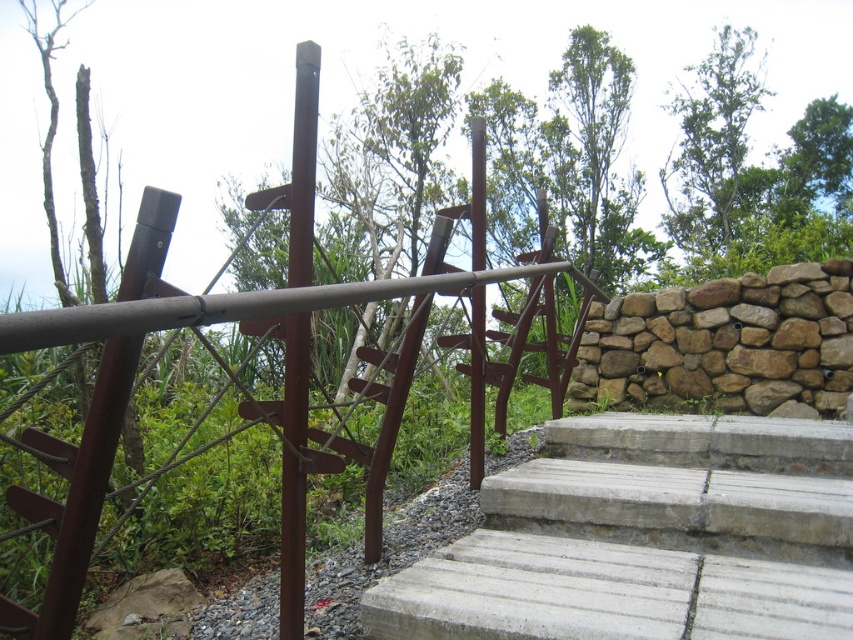
Is point (718, 358) less distant than point (473, 342)?

No.

Is point (595, 307) closer to camera compared to point (480, 356)?

No, it is behind (480, 356).

Locate an element on the screen. Image resolution: width=853 pixels, height=640 pixels. brown rough stone wall at right is located at coordinates (724, 344).

Can you confirm if brown matte pole at center is smaller than brown wooden pole at center?

Incorrect, brown matte pole at center is not smaller in size than brown wooden pole at center.

Does brown matte pole at center appear under brown wooden pole at center?

Yes.

Who is more forward, (287, 406) or (471, 317)?

Point (287, 406) is more forward.

The image size is (853, 640). Identify the location of brown matte pole at center. (294, 474).

Which is below, concrete/steps at lower right or brown matte pole at center?

concrete/steps at lower right is below.

Does concrete/steps at lower right appear on the left side of brown matte pole at center?

No, concrete/steps at lower right is not to the left of brown matte pole at center.

I want to click on concrete/steps at lower right, so click(x=646, y=538).